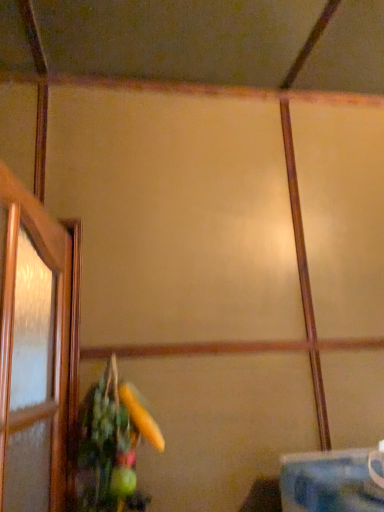
Question: Is green matte floral arrangement at lower left to the left or to the right of blue fabric table at lower right in the image?

Choices:
 (A) left
 (B) right

Answer: (A)

Question: In terms of width, does green matte floral arrangement at lower left look wider or thinner when compared to blue fabric table at lower right?

Choices:
 (A) thin
 (B) wide

Answer: (A)

Question: Based on their sizes in the image, would you say green matte floral arrangement at lower left is bigger or smaller than blue fabric table at lower right?

Choices:
 (A) big
 (B) small

Answer: (A)

Question: From the image's perspective, is blue fabric table at lower right positioned above or below green matte floral arrangement at lower left?

Choices:
 (A) above
 (B) below

Answer: (B)

Question: Is blue fabric table at lower right taller or shorter than green matte floral arrangement at lower left?

Choices:
 (A) short
 (B) tall

Answer: (A)

Question: Do you think blue fabric table at lower right is within green matte floral arrangement at lower left, or outside of it?

Choices:
 (A) outside
 (B) inside

Answer: (A)

Question: Does point (294, 466) appear closer or farther from the camera than point (119, 502)?

Choices:
 (A) closer
 (B) farther

Answer: (A)